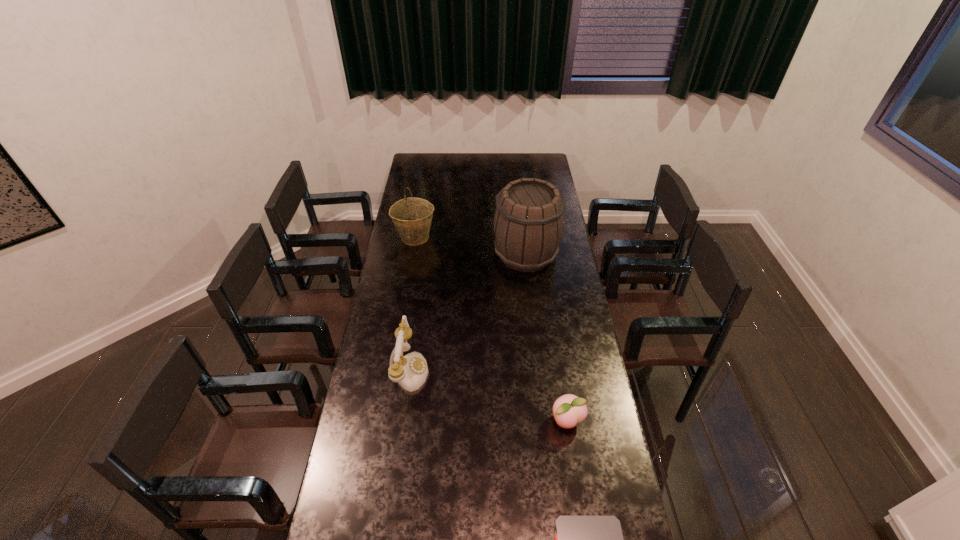
This screenshot has height=540, width=960. I want to click on empty space between the shorter wine bucket and the telephone, so click(412, 303).

Locate an element on the screen. empty space that is in between the second nearest object and the third tallest object is located at coordinates (489, 395).

The width and height of the screenshot is (960, 540). What are the coordinates of `free spot between the third shortest object and the fourth shortest object` in the screenshot? It's located at (412, 303).

This screenshot has width=960, height=540. Find the location of `the second closest object relative to the third shortest object`. the second closest object relative to the third shortest object is located at coordinates (529, 222).

Where is `the second closest object relative to the fourth shortest object`? the second closest object relative to the fourth shortest object is located at coordinates (410, 371).

This screenshot has width=960, height=540. Identify the location of blank area in the image that satisfies the following two spatial constraints: 1. on the dial of the third shortest object; 2. on the back side of the second shortest object. (401, 421).